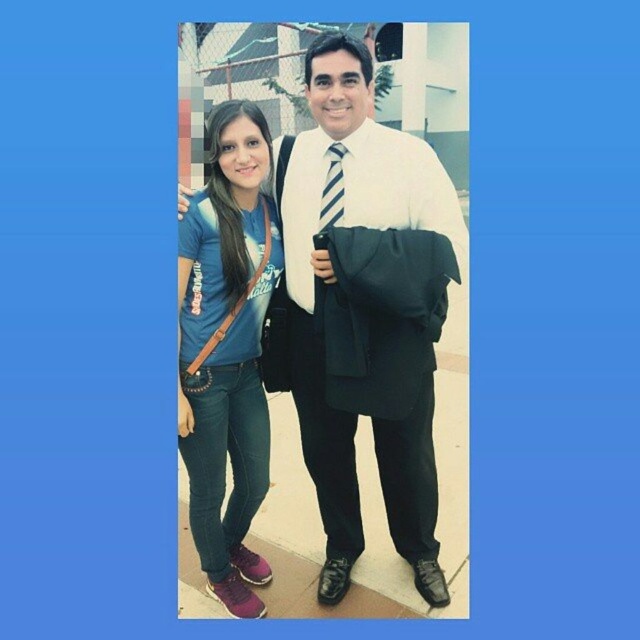
You are a tailor measuring fabric pieces for a project. You have a blue denim jeans at lower left and a striped fabric tie at center. Which fabric piece is wider?

The blue denim jeans at lower left is wider than the striped fabric tie at center.

You are a photographer trying to capture a clear shot of both the blue denim jeans at lower left and the matte black jacket at center. Since you want both items to be in focus, which one should you adjust your camera focus on first to ensure the closest object is sharp?

The blue denim jeans at lower left is closer to the viewer than the matte black jacket at center, so you should focus on the blue denim jeans at lower left first to ensure both are in focus.